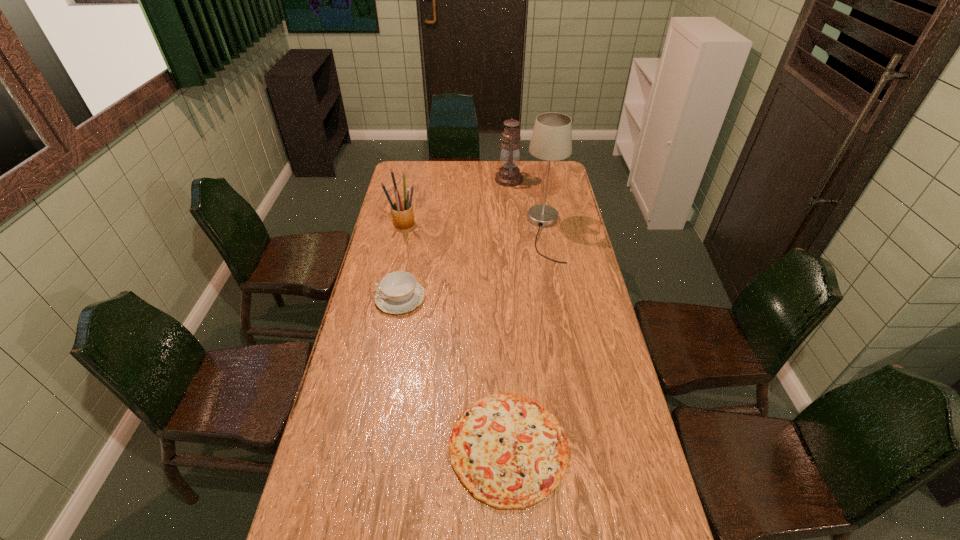
At what (x,y) coordinates should I click in order to perform the action: click on table lamp. Please return your answer as a coordinate pair (x, y). Looking at the image, I should click on (551, 140).

Identify the location of the farthest object. (509, 175).

Identify the location of oil lamp. (509, 175).

The image size is (960, 540). What are the coordinates of `the third tallest object` in the screenshot? It's located at (402, 213).

Where is `the second nearest object`? the second nearest object is located at coordinates (399, 292).

You are a GUI agent. You are given a task and a screenshot of the screen. Output one action in this format:
    pyautogui.click(x=<x>, y=<y>)
    Task: Click on the fourth tallest object
    
    Given the screenshot: What is the action you would take?
    pyautogui.click(x=399, y=292)

At what (x,y) coordinates should I click in order to perform the action: click on the nearest object. Please return your answer as a coordinate pair (x, y). The height and width of the screenshot is (540, 960). Looking at the image, I should click on (509, 451).

The image size is (960, 540). I want to click on pizza, so click(x=509, y=451).

The image size is (960, 540). Identify the location of vacant point located on the front of the table lamp. (562, 327).

The width and height of the screenshot is (960, 540). What are the coordinates of `free space located 0.370m on the front of the oil lamp` in the screenshot? It's located at (514, 234).